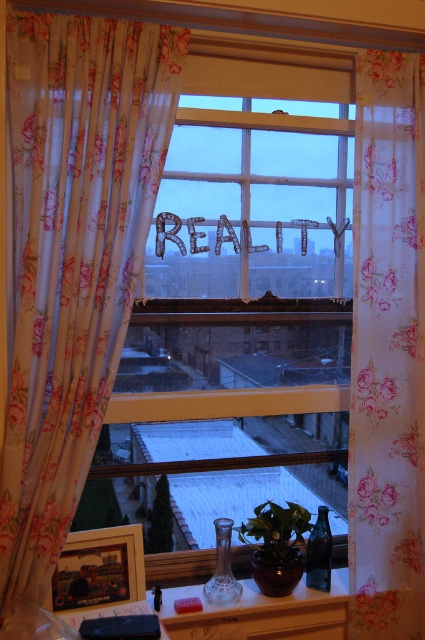
This screenshot has width=425, height=640. Find the location of `floral fabric curtain at center`. floral fabric curtain at center is located at coordinates (71, 253).

Who is positioned more to the right, floral fabric curtain at center or matte glass vase at lower center?

From the viewer's perspective, matte glass vase at lower center appears more on the right side.

What do you see at coordinates (71, 253) in the screenshot? The height and width of the screenshot is (640, 425). I see `floral fabric curtain at center` at bounding box center [71, 253].

At what (x,y) coordinates should I click in order to perform the action: click on floral fabric curtain at center. Please return your answer as a coordinate pair (x, y). Looking at the image, I should click on (71, 253).

Is floral fabric curtain at center bigger than floral sheer curtain at right?

Indeed, floral fabric curtain at center has a larger size compared to floral sheer curtain at right.

Which is above, floral fabric curtain at center or floral sheer curtain at right?

floral fabric curtain at center is above.

Consider the image. Who is more distant from viewer, (110,246) or (408,99)?

The point (408,99) is behind.

At what (x,y) coordinates should I click in order to perform the action: click on floral fabric curtain at center. Please return your answer as a coordinate pair (x, y). This screenshot has height=640, width=425. Looking at the image, I should click on (71, 253).

Is point (419, 556) positioned before point (291, 502)?

That is True.

Who is shorter, floral sheer curtain at right or green matte plant at center?

Standing shorter between the two is green matte plant at center.

Who is more distant from viewer, (354, 417) or (297, 525)?

Point (297, 525)

Find the location of a particular element. floral sheer curtain at right is located at coordinates (385, 355).